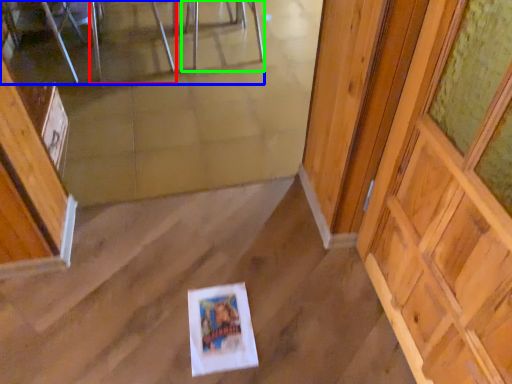
Question: Which is farther away from chair (highlighted by a red box)? furniture (highlighted by a blue box) or chair (highlighted by a green box)?

Choices:
 (A) furniture
 (B) chair

Answer: (B)